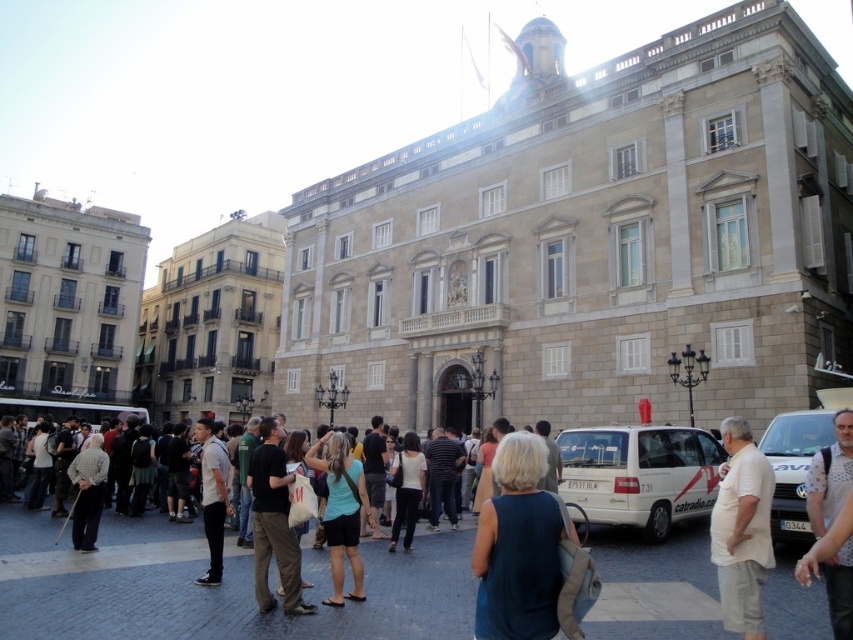
You are a delivery person standing next to the white matte van at center and need to hand over a package to someone wearing the beige cotton shirt at lower right. Can you directly hand over the package without moving from your current position?

The white matte van at center and beige cotton shirt at lower right are 19.63 feet apart from each other. Since the distance is too far to reach directly, you would need to move closer to hand over the package.

You are standing at the center of the scene looking towards the historic building. Where is the white matte van at lower right located relative to your position?

The white matte van at lower right is located at the lower right of the scene, positioned at coordinates approximately 0.731 on the x axis and 0.932 on the y axis.

Consider the image. You are a delivery person trying to park your white matte van at center near the beige cotton shirt at lower right. Considering their sizes, which one occupies more space in the parking area?

The beige cotton shirt at lower right occupies more space in the parking area since the white matte van at center has a smaller size compared to it.